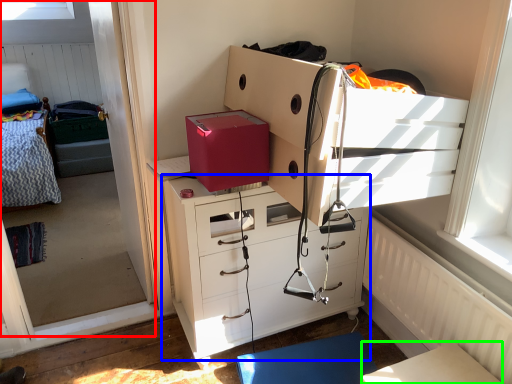
Question: Considering the real-world distances, which object is farthest from window screen (highlighted by a red box)? chest of drawers (highlighted by a blue box) or table (highlighted by a green box)?

Choices:
 (A) chest of drawers
 (B) table

Answer: (B)